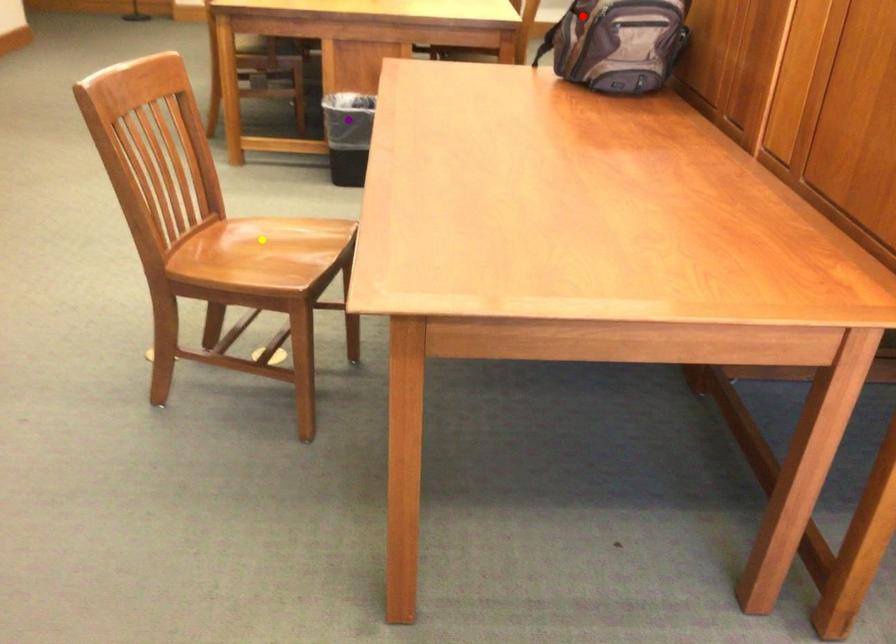
Order these from nearest to farthest:
red point
yellow point
purple point

yellow point
red point
purple point